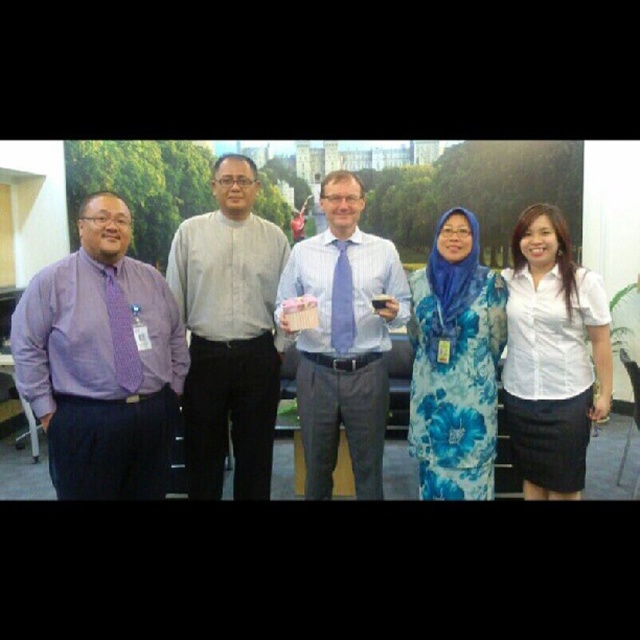
Question: Is light gray cotton shirt at center above purple dotted tie at left?

Choices:
 (A) no
 (B) yes

Answer: (B)

Question: Which is nearer to the purple matte shirt at left?

Choices:
 (A) light blue fabric shirt at center
 (B) white matte shirt at right

Answer: (A)

Question: Which object is closer to the camera taking this photo?

Choices:
 (A) blue floral dress at center
 (B) white matte shirt at right
 (C) purple matte shirt at left

Answer: (C)

Question: Estimate the real-world distances between objects in this image. Which object is farther from the white matte shirt at right?

Choices:
 (A) light blue fabric shirt at center
 (B) light gray cotton shirt at center
 (C) matte blue tie at center
 (D) purple dotted tie at left

Answer: (D)

Question: Does white matte shirt at right have a lesser width compared to blue floral dress at center?

Choices:
 (A) yes
 (B) no

Answer: (B)

Question: Does light blue fabric shirt at center come in front of matte blue tie at center?

Choices:
 (A) yes
 (B) no

Answer: (A)